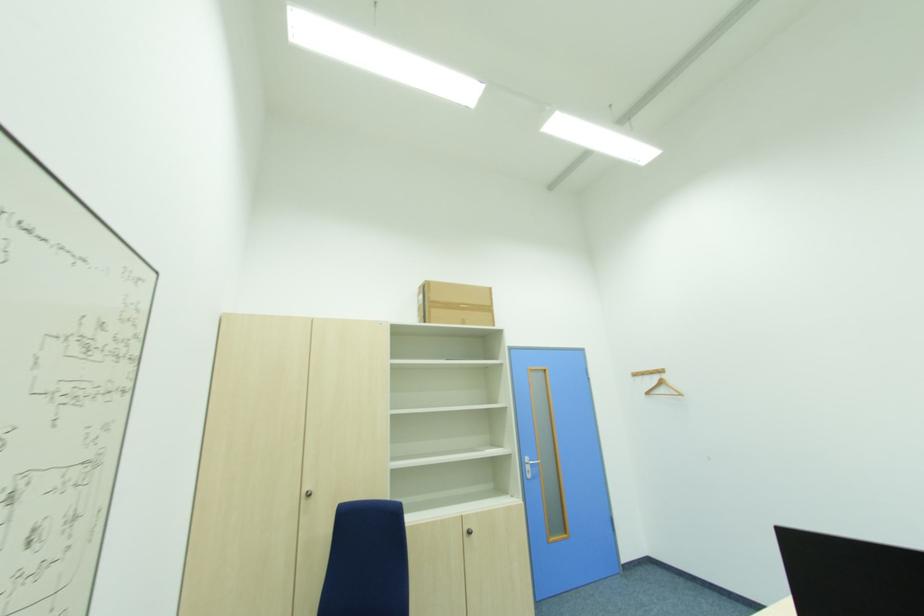
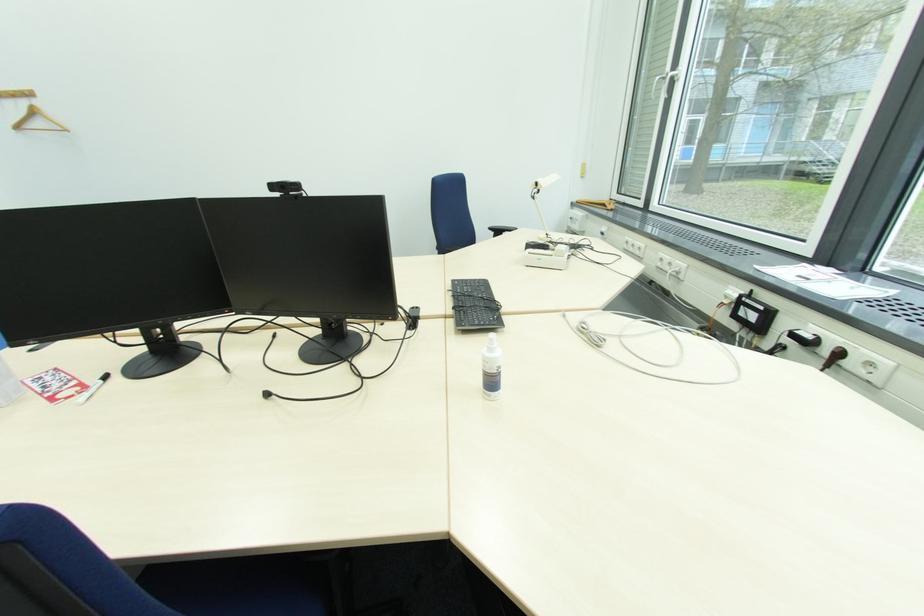
How did the camera likely rotate?

The camera's rotation is toward right-down.